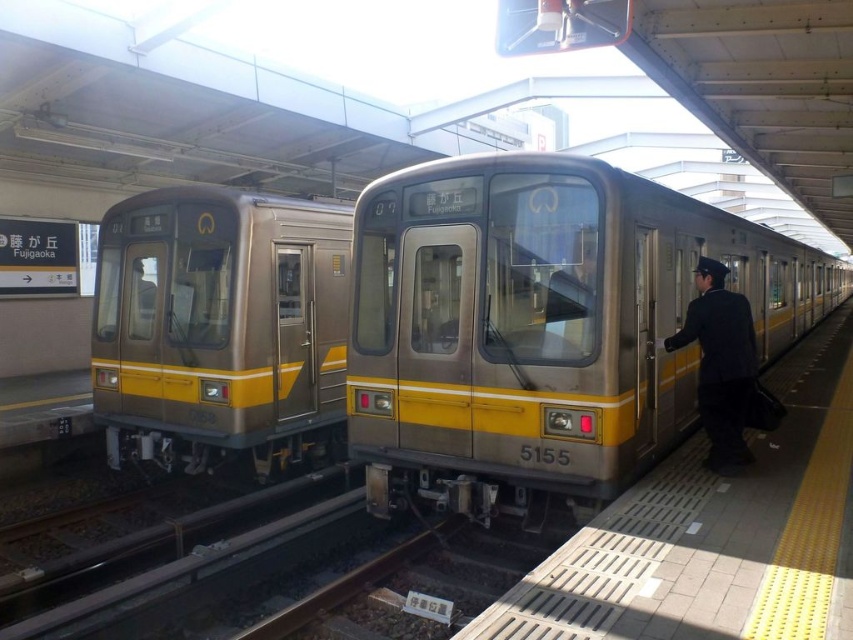
Question: Among these points, which one is farthest from the camera?

Choices:
 (A) (838, 401)
 (B) (109, 424)
 (C) (463, 509)

Answer: (A)

Question: Is metallic silver train at left closer to camera compared to dark blue uniform at right?

Choices:
 (A) no
 (B) yes

Answer: (A)

Question: Is metallic silver train at center below metallic silver train at left?

Choices:
 (A) yes
 (B) no

Answer: (B)

Question: Does metallic platform at center lie behind dark blue uniform at right?

Choices:
 (A) yes
 (B) no

Answer: (B)

Question: Which point appears farthest from the camera in this image?

Choices:
 (A) [x=613, y=422]
 (B) [x=636, y=547]
 (C) [x=680, y=333]
 (D) [x=245, y=269]

Answer: (D)

Question: Which point is closer to the camera taking this photo?

Choices:
 (A) (280, 317)
 (B) (659, 548)

Answer: (B)